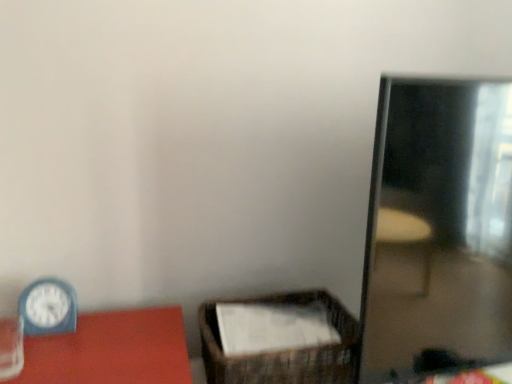
Question: In terms of size, does shiny reflective mirror at right appear bigger or smaller than brown woven basket at center?

Choices:
 (A) small
 (B) big

Answer: (B)

Question: In terms of width, does shiny reflective mirror at right look wider or thinner when compared to brown woven basket at center?

Choices:
 (A) thin
 (B) wide

Answer: (B)

Question: Which is nearer to the brown woven basket at center?

Choices:
 (A) shiny reflective mirror at right
 (B) blue plastic clock at left

Answer: (A)

Question: Based on their relative distances, which object is farther from the shiny reflective mirror at right?

Choices:
 (A) blue plastic clock at left
 (B) brown woven basket at center

Answer: (A)